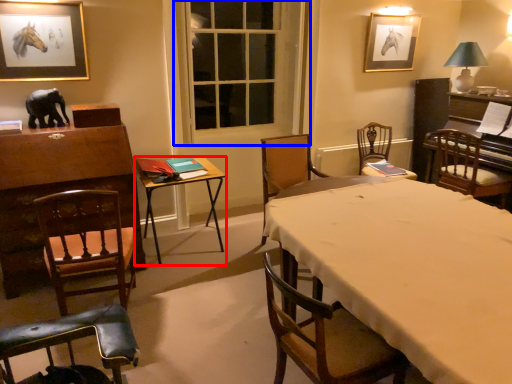
Question: Among these objects, which one is nearest to the camera, table (highlighted by a red box) or window screen (highlighted by a blue box)?

Choices:
 (A) table
 (B) window screen

Answer: (A)